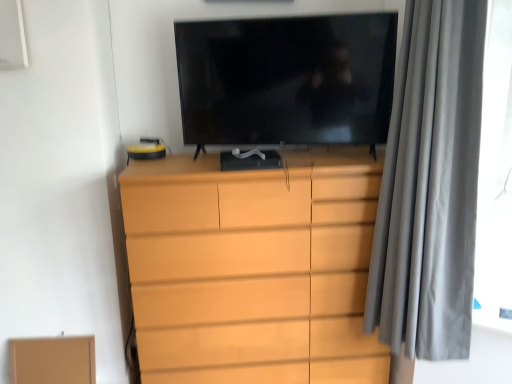
Question: Considering the relative sizes of matte wood chest of drawers at center and black glossy tv at center in the image provided, is matte wood chest of drawers at center smaller than black glossy tv at center?

Choices:
 (A) no
 (B) yes

Answer: (A)

Question: From a real-world perspective, is matte wood chest of drawers at center positioned over black glossy tv at center based on gravity?

Choices:
 (A) no
 (B) yes

Answer: (A)

Question: Can you confirm if matte wood chest of drawers at center is bigger than black glossy tv at center?

Choices:
 (A) no
 (B) yes

Answer: (B)

Question: Is matte wood chest of drawers at center in front of black glossy tv at center?

Choices:
 (A) no
 (B) yes

Answer: (A)

Question: Considering the relative sizes of matte wood chest of drawers at center and black glossy tv at center in the image provided, is matte wood chest of drawers at center shorter than black glossy tv at center?

Choices:
 (A) no
 (B) yes

Answer: (A)

Question: Considering the positions of brown cardboard box at lower left and gray velvet curtain at right in the image, is brown cardboard box at lower left taller or shorter than gray velvet curtain at right?

Choices:
 (A) short
 (B) tall

Answer: (A)

Question: From a real-world perspective, is brown cardboard box at lower left physically located above or below gray velvet curtain at right?

Choices:
 (A) below
 (B) above

Answer: (A)

Question: Based on their sizes in the image, would you say brown cardboard box at lower left is bigger or smaller than gray velvet curtain at right?

Choices:
 (A) small
 (B) big

Answer: (A)

Question: Relative to gray velvet curtain at right, is brown cardboard box at lower left in front or behind?

Choices:
 (A) front
 (B) behind

Answer: (B)

Question: Considering the positions of brown cardboard box at lower left and black glossy tv at center in the image, is brown cardboard box at lower left taller or shorter than black glossy tv at center?

Choices:
 (A) short
 (B) tall

Answer: (A)

Question: In the image, is brown cardboard box at lower left positioned in front of or behind black glossy tv at center?

Choices:
 (A) behind
 (B) front

Answer: (A)

Question: Looking at their shapes, would you say brown cardboard box at lower left is wider or thinner than black glossy tv at center?

Choices:
 (A) thin
 (B) wide

Answer: (A)

Question: Is point pos(26,344) closer or farther from the camera than point pos(292,130)?

Choices:
 (A) farther
 (B) closer

Answer: (A)

Question: From the image's perspective, is black glossy tv at center above or below gray velvet curtain at right?

Choices:
 (A) below
 (B) above

Answer: (B)

Question: In terms of height, does black glossy tv at center look taller or shorter compared to gray velvet curtain at right?

Choices:
 (A) tall
 (B) short

Answer: (B)